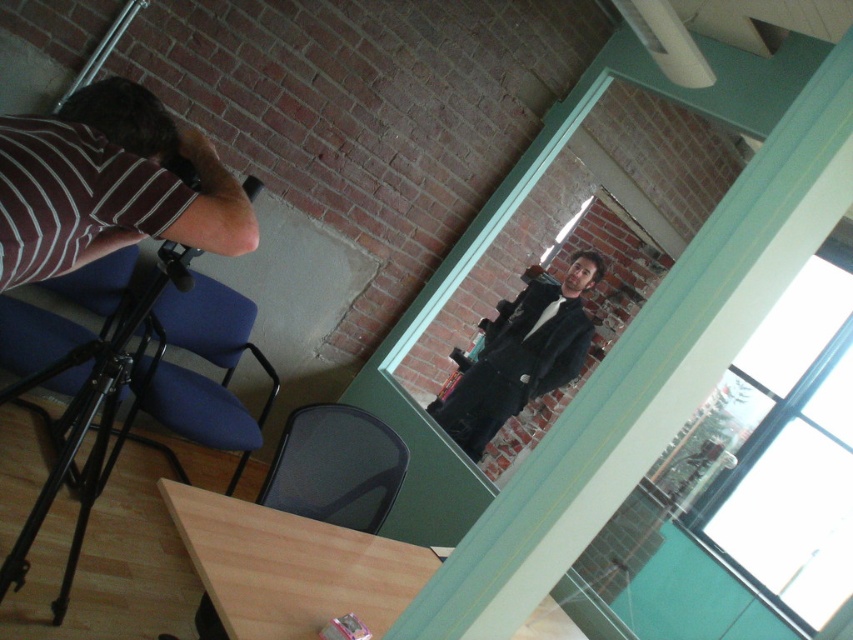
Question: Does black matte jacket at center appear over black metal tripod at lower left?

Choices:
 (A) yes
 (B) no

Answer: (A)

Question: Among these points, which one is nearest to the camera?

Choices:
 (A) (305, 582)
 (B) (19, 150)
 (C) (73, 566)

Answer: (B)

Question: Does striped fabric shirt at left appear on the right side of black matte jacket at center?

Choices:
 (A) no
 (B) yes

Answer: (A)

Question: Estimate the real-world distances between objects in this image. Which object is farther from the light wood table at lower center?

Choices:
 (A) striped fabric shirt at left
 (B) black matte jacket at center

Answer: (B)

Question: Does striped fabric shirt at left appear under black matte jacket at center?

Choices:
 (A) yes
 (B) no

Answer: (B)

Question: Which object appears farthest from the camera in this image?

Choices:
 (A) black matte jacket at center
 (B) striped fabric shirt at left
 (C) light wood table at lower center
 (D) black metal tripod at lower left

Answer: (A)